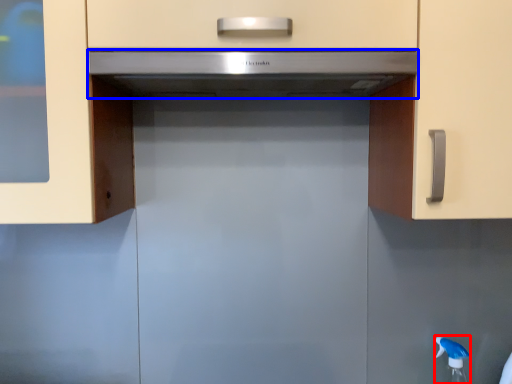
Question: Which object appears farthest to the camera in this image, faucet (highlighted by a red box) or home appliance (highlighted by a blue box)?

Choices:
 (A) faucet
 (B) home appliance

Answer: (A)